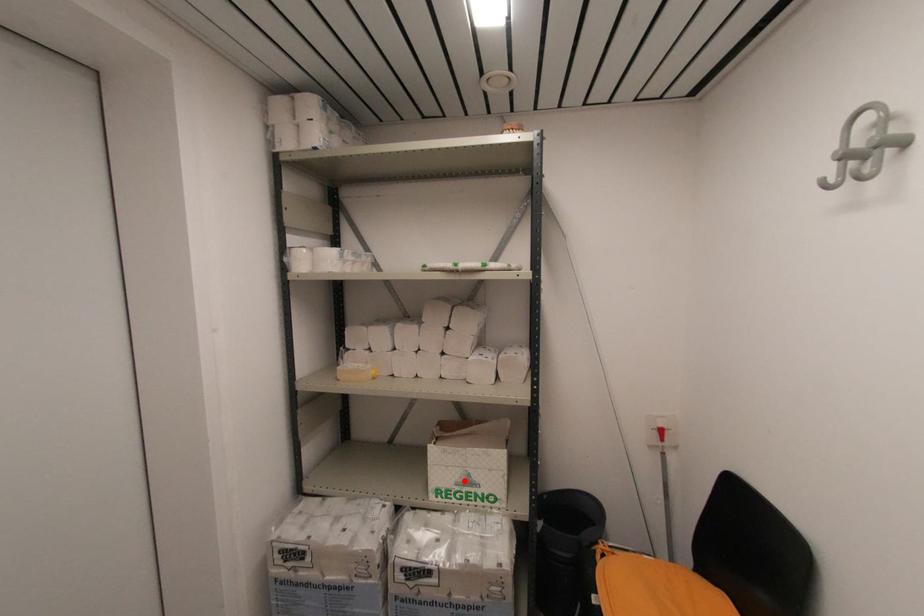
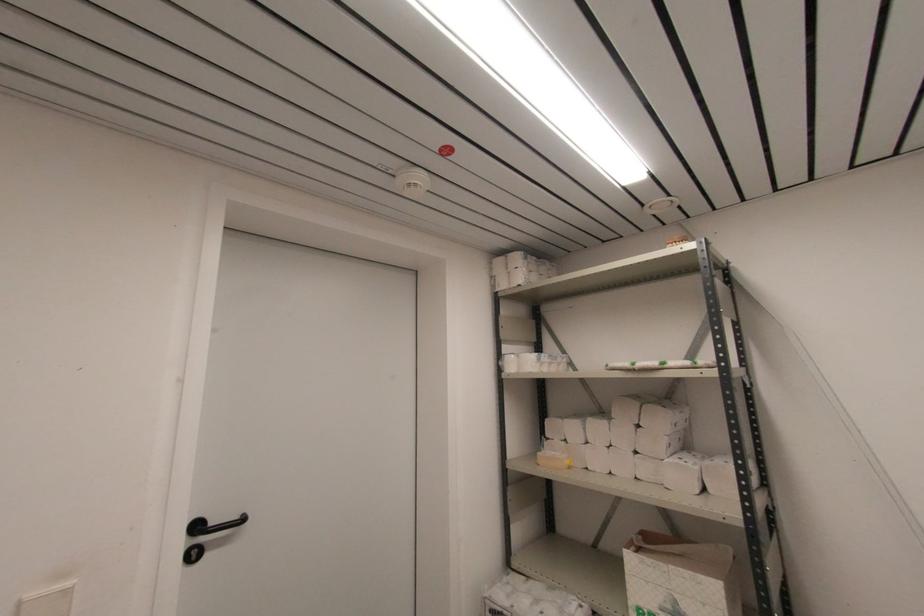
Question: I am providing you with two images of the same scene from different viewpoints. A red point is shown in image1. For the corresponding object point in image2, is it positioned nearer or farther from the camera?

Choices:
 (A) Nearer
 (B) Farther

Answer: (A)